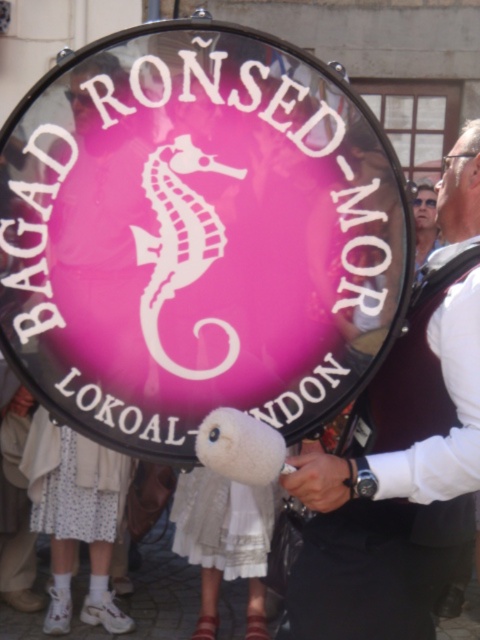
You are standing in front of a large pink drum with text and a seahorse logo. You see a white fabric vest at center and a white fluffy animal at center. Which one is positioned higher on your view?

The white fabric vest at center is located above the white fluffy animal at center, so the white fabric vest at center is positioned higher on your view.

You are an event planner organizing a cultural festival. You need to place a small flag exactly between the white plastic seahorse at center and the white fluffy animal at center on the drum. Which object should the flag be closer to?

The flag should be closer to the white fluffy animal at center because the white plastic seahorse at center is taller than the white fluffy animal at center, meaning the fluffy animal is shorter and thus positioned lower, so the midpoint between them would be closer to the lower object.